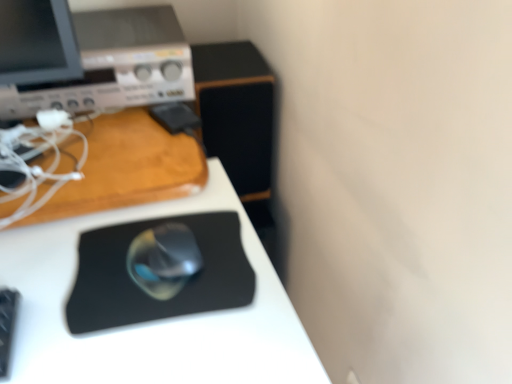
This screenshot has width=512, height=384. I want to click on vacant area to the left of satin silver mouse at center, so click(x=67, y=264).